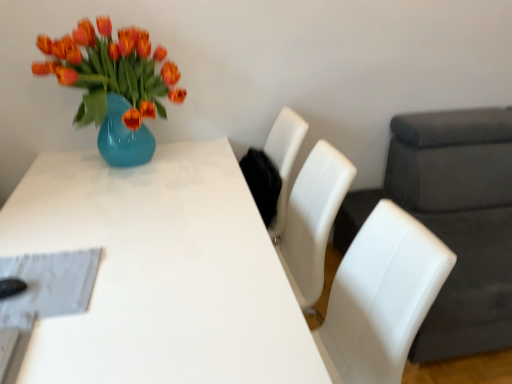
In order to click on free point above white glossy table at center (from a real-world perspective) in this screenshot , I will do `click(129, 231)`.